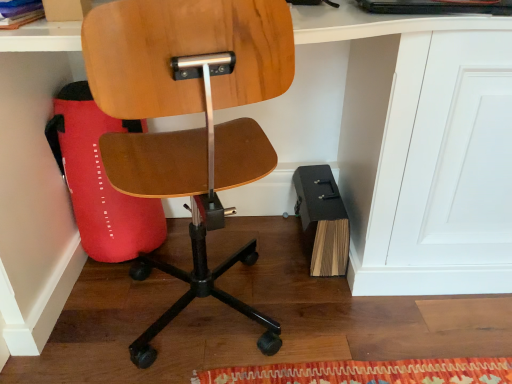
What are the coordinates of `blank space to the left of wooden chair at center` in the screenshot? It's located at (86, 332).